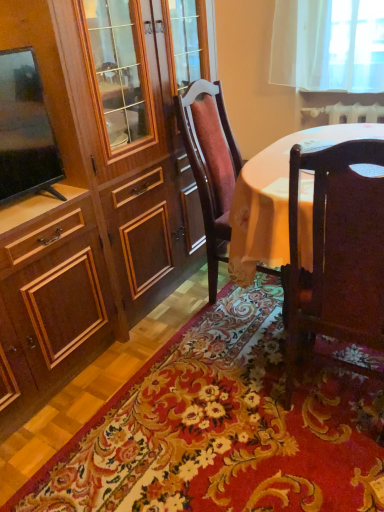
This screenshot has height=512, width=384. I want to click on dark wood chair at lower right, arranged as the 2th chair when viewed from the back, so click(337, 251).

Locate an element on the screen. The image size is (384, 512). matte black tv at left is located at coordinates (25, 130).

Who is more distant, floral carpet at center or matte black tv at left?

matte black tv at left.

Would you say matte black tv at left is part of floral carpet at center's contents?

No, matte black tv at left is located outside of floral carpet at center.

Can you confirm if floral carpet at center is positioned to the right of matte black tv at left?

Yes, floral carpet at center is to the right of matte black tv at left.

Does dark wood chair at lower right, arranged as the 2th chair when viewed from the back, appear on the left side of floral carpet at center?

No, dark wood chair at lower right, arranged as the 2th chair when viewed from the back, is not to the left of floral carpet at center.

Can you confirm if dark wood chair at lower right, arranged as the 2th chair when viewed from the back, is shorter than floral carpet at center?

No.

What's the angular difference between dark wood chair at lower right, arranged as the 2th chair when viewed from the back, and floral carpet at center's facing directions?

dark wood chair at lower right, arranged as the 2th chair when viewed from the back, and floral carpet at center are facing 179 degrees away from each other.

Is the depth of dark wood chair at lower right, the first chair from the front, greater than that of floral carpet at center?

No, the depth of dark wood chair at lower right, the first chair from the front, is less than that of floral carpet at center.

Which is closer to the camera, (59, 176) or (214, 215)?

Point (59, 176) appears to be closer to the viewer than point (214, 215).

Considering the sizes of objects matte black tv at left and wooden chair at center, placed as the 1th chair when sorted from back to front, in the image provided, who is smaller, matte black tv at left or wooden chair at center, placed as the 1th chair when sorted from back to front,?

matte black tv at left.

Which object is closer to the camera taking this photo, matte black tv at left or wooden chair at center, placed as the 1th chair when sorted from back to front?

matte black tv at left is in front.

Could you tell me if matte black tv at left is turned towards wooden chair at center, placed as the 1th chair when sorted from back to front?

No, matte black tv at left is not aimed at wooden chair at center, placed as the 1th chair when sorted from back to front.

Would you say dark wood chair at lower right, arranged as the 2th chair when viewed from the back, is part of matte black tv at left's contents?

No, dark wood chair at lower right, arranged as the 2th chair when viewed from the back, is not inside matte black tv at left.

From a real-world perspective, relative to dark wood chair at lower right, the first chair from the front, is matte black tv at left vertically above or below?

matte black tv at left is above dark wood chair at lower right, the first chair from the front.

Which is more to the left, matte black tv at left or dark wood chair at lower right, the first chair from the front?

Positioned to the left is matte black tv at left.

Image resolution: width=384 pixels, height=512 pixels. Identify the location of television that appears on the left of dark wood chair at lower right, the first chair from the front. 25,130.

Considering the relative positions of dark wood chair at lower right, the first chair from the front, and wooden chair at center, placed as the 1th chair when sorted from back to front, in the image provided, is dark wood chair at lower right, the first chair from the front, to the left of wooden chair at center, placed as the 1th chair when sorted from back to front, from the viewer's perspective?

No, dark wood chair at lower right, the first chair from the front, is not to the left of wooden chair at center, placed as the 1th chair when sorted from back to front.

Where is `chair that appears in front of the wooden chair at center, placed as the 1th chair when sorted from back to front`? This screenshot has height=512, width=384. chair that appears in front of the wooden chair at center, placed as the 1th chair when sorted from back to front is located at coordinates (337, 251).

Which object is wider, dark wood chair at lower right, arranged as the 2th chair when viewed from the back, or wooden chair at center, placed as the 1th chair when sorted from back to front?

wooden chair at center, placed as the 1th chair when sorted from back to front.

Considering the points (303, 277) and (8, 174), which point is in front, point (303, 277) or point (8, 174)?

The point (303, 277) is in front.

Is dark wood chair at lower right, arranged as the 2th chair when viewed from the back, at the left side of matte black tv at left?

No.

From the picture: Which of these two, dark wood chair at lower right, arranged as the 2th chair when viewed from the back, or matte black tv at left, is thinner?

matte black tv at left is thinner.

Considering the relative sizes of dark wood chair at lower right, the first chair from the front, and matte black tv at left in the image provided, is dark wood chair at lower right, the first chair from the front, taller than matte black tv at left?

Correct, dark wood chair at lower right, the first chair from the front, is much taller as matte black tv at left.

Which of these two, wooden chair at center, placed as the 1th chair when sorted from back to front, or dark wood chair at lower right, the first chair from the front, is wider?

Wider between the two is wooden chair at center, placed as the 1th chair when sorted from back to front.

Where is `chair that is on the right side of wooden chair at center, placed as the 1th chair when sorted from back to front`? Image resolution: width=384 pixels, height=512 pixels. chair that is on the right side of wooden chair at center, placed as the 1th chair when sorted from back to front is located at coordinates (337, 251).

From a real-world perspective, who is located lower, wooden chair at center, placed as the 1th chair when sorted from back to front, or dark wood chair at lower right, the first chair from the front?

dark wood chair at lower right, the first chair from the front, from a real-world perspective.

Does wooden chair at center, placed as the 1th chair when sorted from back to front, have a larger size compared to dark wood chair at lower right, arranged as the 2th chair when viewed from the back?

Indeed, wooden chair at center, placed as the 1th chair when sorted from back to front, has a larger size compared to dark wood chair at lower right, arranged as the 2th chair when viewed from the back.

This screenshot has width=384, height=512. I want to click on television on the left of floral carpet at center, so click(25, 130).

I want to click on mat behind the dark wood chair at lower right, the first chair from the front, so click(x=223, y=428).

Which object lies further to the anchor point matte black tv at left, floral carpet at center or wooden chair at center, which ranks as the 2th chair in front-to-back order?

floral carpet at center is positioned further to the anchor matte black tv at left.

Considering their positions, is wooden chair at center, placed as the 1th chair when sorted from back to front, positioned further to matte black tv at left than floral carpet at center?

Based on the image, floral carpet at center appears to be further to matte black tv at left.

Based on their spatial positions, is dark wood chair at lower right, the first chair from the front, or matte black tv at left further from wooden chair at center, placed as the 1th chair when sorted from back to front?

dark wood chair at lower right, the first chair from the front.

When comparing their distances from dark wood chair at lower right, arranged as the 2th chair when viewed from the back, does matte black tv at left or wooden chair at center, which ranks as the 2th chair in front-to-back order, seem closer?

wooden chair at center, which ranks as the 2th chair in front-to-back order, is positioned closer to the anchor dark wood chair at lower right, arranged as the 2th chair when viewed from the back.

Estimate the real-world distances between objects in this image. Which object is further from wooden chair at center, placed as the 1th chair when sorted from back to front, floral carpet at center or dark wood chair at lower right, the first chair from the front?

Among the two, dark wood chair at lower right, the first chair from the front, is located further to wooden chair at center, placed as the 1th chair when sorted from back to front.

Based on their spatial positions, is dark wood chair at lower right, arranged as the 2th chair when viewed from the back, or wooden chair at center, which ranks as the 2th chair in front-to-back order, further from matte black tv at left?

dark wood chair at lower right, arranged as the 2th chair when viewed from the back, is further to matte black tv at left.

Estimate the real-world distances between objects in this image. Which object is further from dark wood chair at lower right, the first chair from the front, floral carpet at center or wooden chair at center, placed as the 1th chair when sorted from back to front?

Among the two, wooden chair at center, placed as the 1th chair when sorted from back to front, is located further to dark wood chair at lower right, the first chair from the front.

From the image, which object appears to be nearer to matte black tv at left, floral carpet at center or dark wood chair at lower right, the first chair from the front?

dark wood chair at lower right, the first chair from the front.

Where is `chair that lies between wooden chair at center, which ranks as the 2th chair in front-to-back order, and floral carpet at center from top to bottom`? This screenshot has width=384, height=512. chair that lies between wooden chair at center, which ranks as the 2th chair in front-to-back order, and floral carpet at center from top to bottom is located at coordinates (337, 251).

Identify the location of chair situated between matte black tv at left and dark wood chair at lower right, the first chair from the front, from left to right. The image size is (384, 512). (210, 164).

At what (x,y) coordinates should I click in order to perform the action: click on mat situated between matte black tv at left and dark wood chair at lower right, arranged as the 2th chair when viewed from the back, from left to right. Please return your answer as a coordinate pair (x, y). The image size is (384, 512). Looking at the image, I should click on (223, 428).